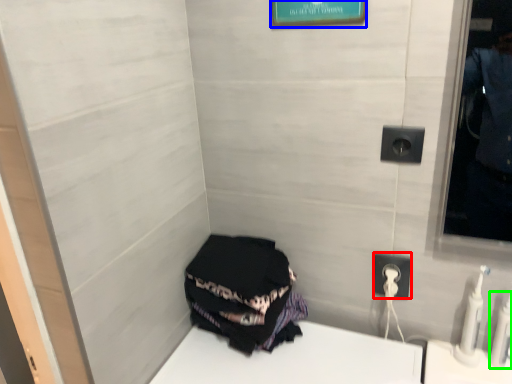
Question: Which object is positioned farthest from power outlet (highlighted by a red box)? Select from picture frame (highlighted by a blue box) and toiletry (highlighted by a green box).

Choices:
 (A) picture frame
 (B) toiletry

Answer: (A)